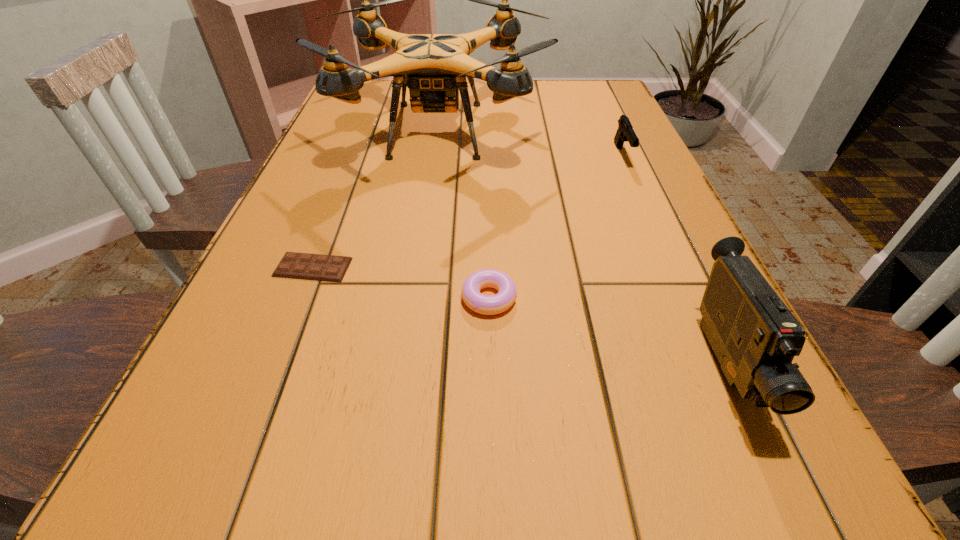
Where is `vacant space at the far right corner`? The width and height of the screenshot is (960, 540). vacant space at the far right corner is located at coordinates (584, 87).

Identify the location of free point between the fourth shortest object and the third shortest object. The width and height of the screenshot is (960, 540). (673, 259).

Find the location of a particular element. The image size is (960, 540). empty space between the chocolate bar and the second shortest object is located at coordinates (401, 282).

Locate an element on the screen. The image size is (960, 540). empty location between the third shortest object and the shortest object is located at coordinates (468, 211).

Where is `blank region between the shortest object and the tallest object`? The height and width of the screenshot is (540, 960). blank region between the shortest object and the tallest object is located at coordinates (375, 199).

At what (x,y) coordinates should I click in order to perform the action: click on vacant space that is in between the pistol and the second shortest object. Please return your answer as a coordinate pair (x, y). The width and height of the screenshot is (960, 540). Looking at the image, I should click on (556, 226).

You are a GUI agent. You are given a task and a screenshot of the screen. Output one action in this format:
    pyautogui.click(x=<x>, y=<y>)
    Task: Click on the vacant area that lies between the drone and the shortest object
    
    Given the screenshot: What is the action you would take?
    pyautogui.click(x=375, y=199)

The image size is (960, 540). In order to click on vacant space that is in between the third tallest object and the drone in this screenshot , I will do `click(530, 142)`.

You are a GUI agent. You are given a task and a screenshot of the screen. Output one action in this format:
    pyautogui.click(x=<x>, y=<y>)
    Task: Click on the vacant space in between the camcorder and the pistol
    
    Given the screenshot: What is the action you would take?
    pyautogui.click(x=673, y=259)

At what (x,y) coordinates should I click in order to perform the action: click on free space between the tallest object and the fourth tallest object. Please return your answer as a coordinate pair (x, y). Image resolution: width=960 pixels, height=540 pixels. Looking at the image, I should click on (463, 214).